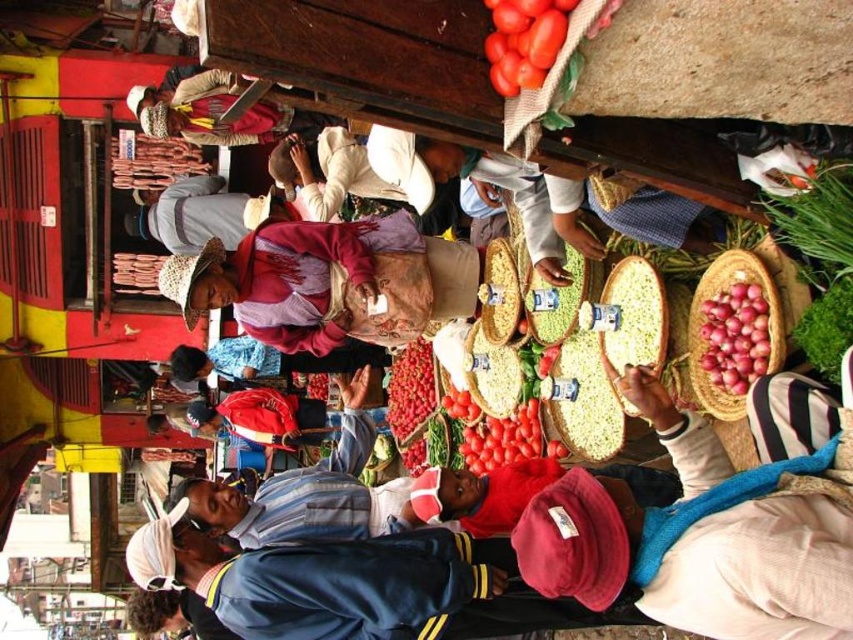
You are a customer at the market and want to pick up both the matte purple scarf at center and the shiny red tomatoes at center. However, you can only reach items within 2 meters. Can you reach both items without moving?

The matte purple scarf at center is 20.52 meters away from the shiny red tomatoes at center. Since you can only reach items within 2 meters, you cannot reach both items without moving.